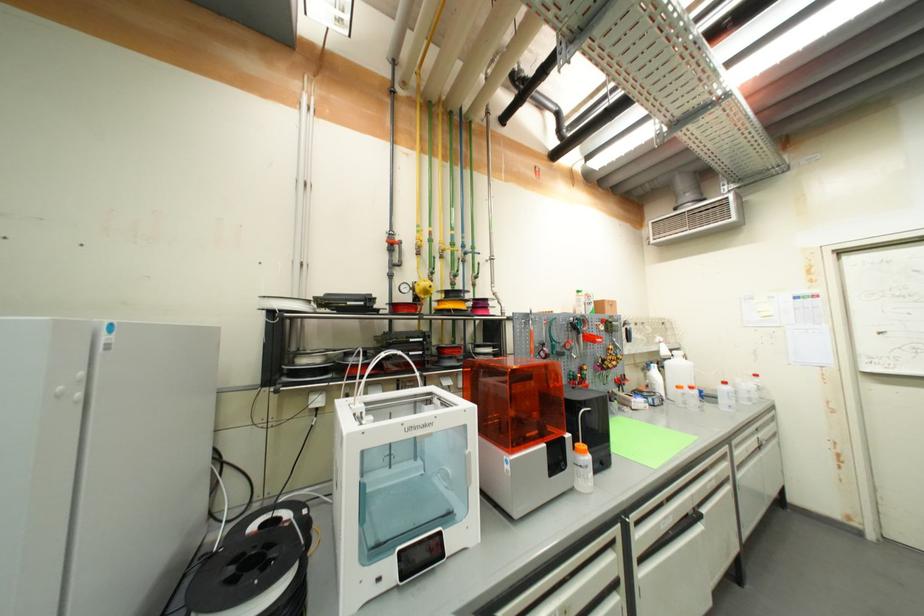
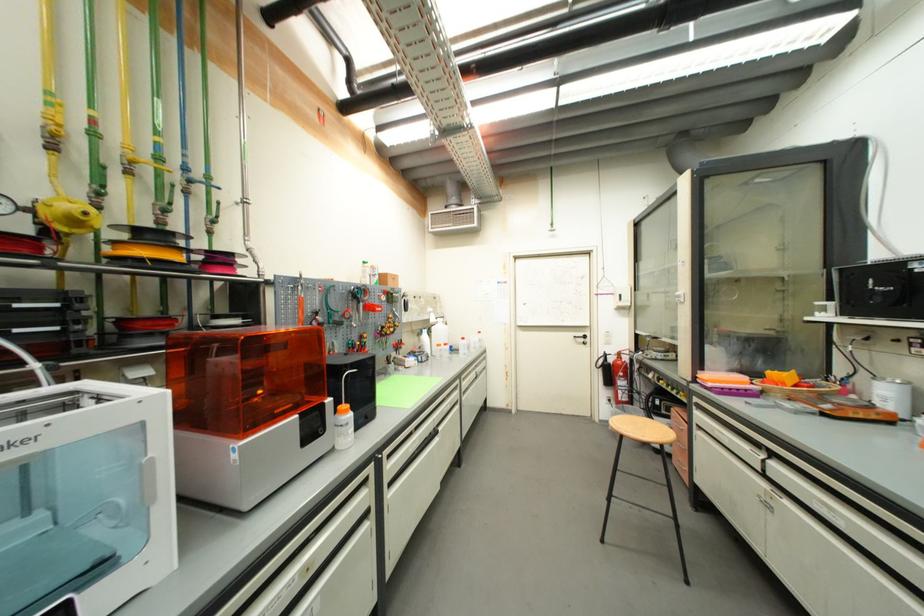
Find the pixel in the second image that matches [456,275] in the first image.

(160, 207)